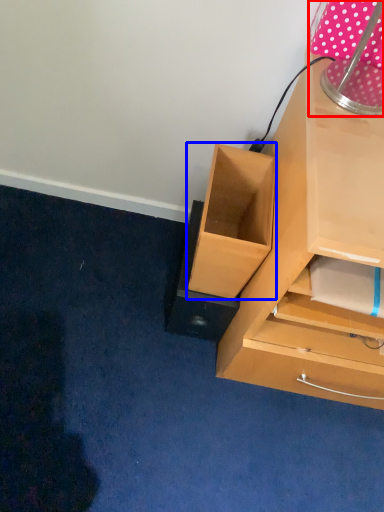
Question: Which point is further to the camera, table lamp (highlighted by a red box) or drawer (highlighted by a blue box)?

Choices:
 (A) table lamp
 (B) drawer

Answer: (B)